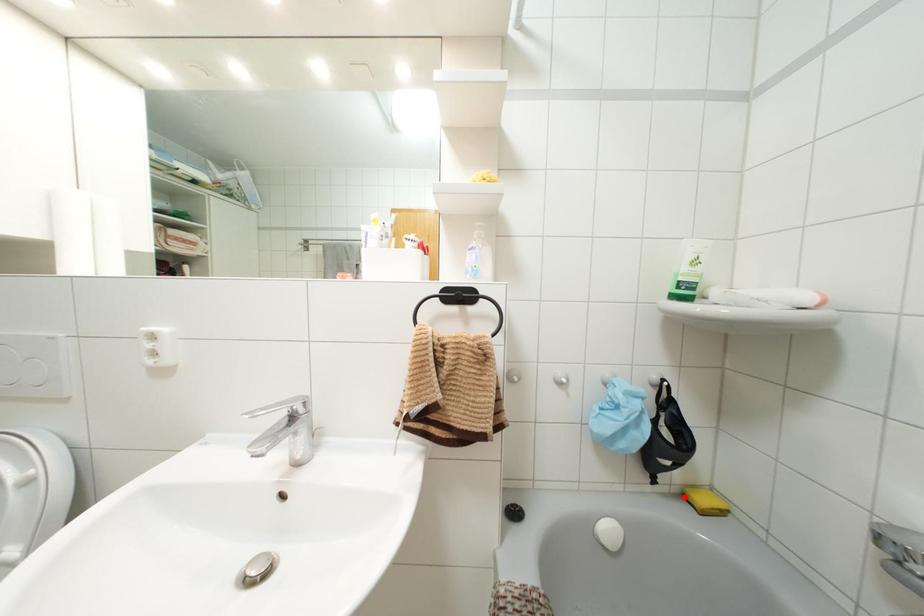
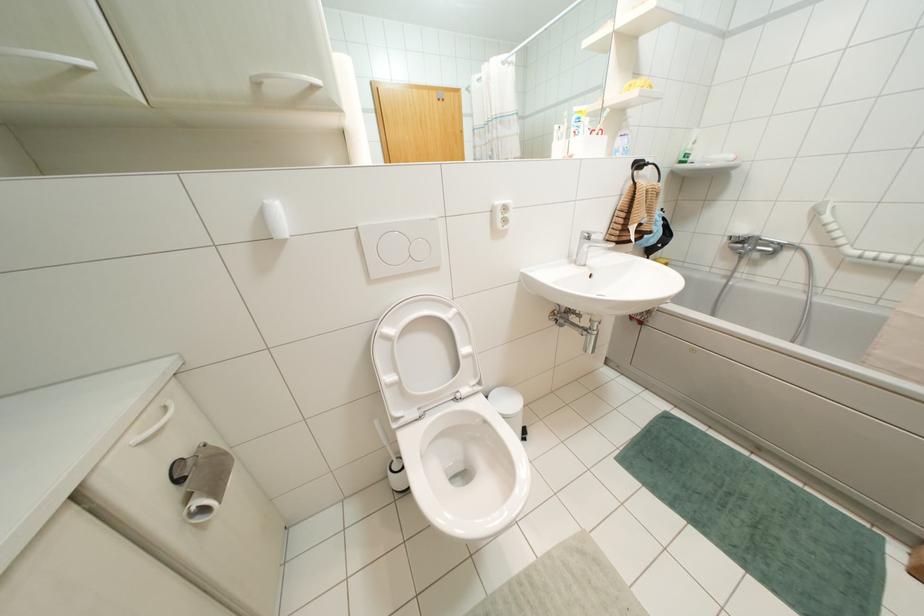
Question: I am providing you with two images of the same scene from different viewpoints. A red point is marked on the first image. At the location where the point appears in image 1, is it still visible in image 2?

Choices:
 (A) Yes
 (B) No

Answer: (B)